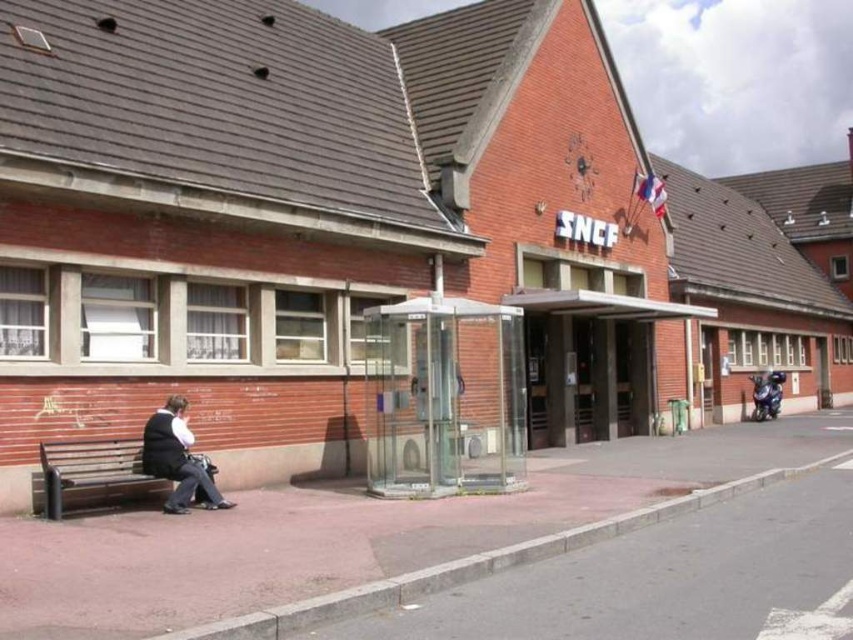
Question: Does brown concrete pavement at lower left appear over dark gray fabric jacket at lower left?

Choices:
 (A) yes
 (B) no

Answer: (B)

Question: Does brown concrete pavement at lower left come behind wooden bench at lower left?

Choices:
 (A) yes
 (B) no

Answer: (B)

Question: Considering the relative positions of transparent glass bus stop at center and wooden bench at lower left in the image provided, where is transparent glass bus stop at center located with respect to wooden bench at lower left?

Choices:
 (A) above
 (B) below

Answer: (A)

Question: Which of these objects is positioned closest to the wooden bench at lower left?

Choices:
 (A) brown concrete pavement at lower left
 (B) dark gray fabric jacket at lower left
 (C) transparent glass bus stop at center

Answer: (B)

Question: Which of the following is the farthest from the observer?

Choices:
 (A) dark gray fabric jacket at lower left
 (B) wooden bench at lower left
 (C) transparent glass bus stop at center
 (D) brown concrete pavement at lower left

Answer: (C)

Question: Which of the following is the closest to the observer?

Choices:
 (A) dark gray fabric jacket at lower left
 (B) wooden bench at lower left
 (C) transparent glass bus stop at center
 (D) brown concrete pavement at lower left

Answer: (D)